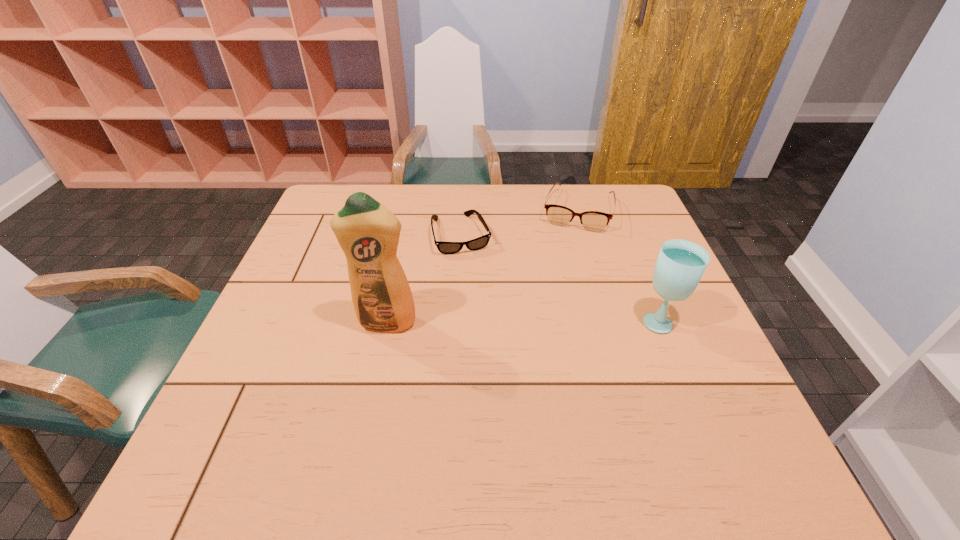
Find the location of `vacant space on the desktop that is between the tallest object and the glass and is positioned on the front-facing side of the third object from right to left`. vacant space on the desktop that is between the tallest object and the glass and is positioned on the front-facing side of the third object from right to left is located at coordinates (493, 322).

Locate an element on the screen. free spot on the desktop that is between the detergent and the glass and is positioned on the face of the third tallest object is located at coordinates (548, 321).